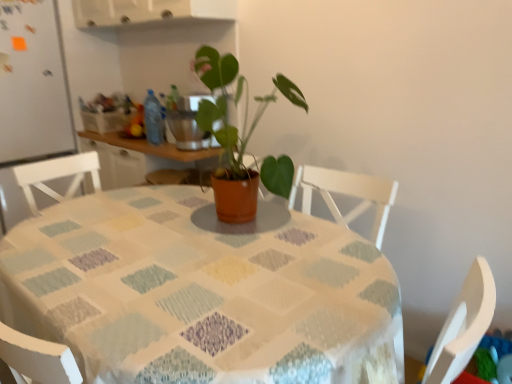
Question: Considering the relative sizes of matte terracotta pot at center and textured fabric tablecloth at center in the image provided, is matte terracotta pot at center wider than textured fabric tablecloth at center?

Choices:
 (A) yes
 (B) no

Answer: (B)

Question: Could you tell me if matte terracotta pot at center is facing textured fabric tablecloth at center?

Choices:
 (A) no
 (B) yes

Answer: (A)

Question: Is matte terracotta pot at center further to the viewer compared to textured fabric tablecloth at center?

Choices:
 (A) no
 (B) yes

Answer: (B)

Question: Is matte terracotta pot at center oriented away from textured fabric tablecloth at center?

Choices:
 (A) yes
 (B) no

Answer: (B)

Question: Is the position of matte terracotta pot at center less distant than that of textured fabric tablecloth at center?

Choices:
 (A) no
 (B) yes

Answer: (A)

Question: Is matte terracotta pot at center inside or outside of white matte refrigerator at left?

Choices:
 (A) inside
 (B) outside

Answer: (B)

Question: Is point (256, 188) positioned closer to the camera than point (15, 132)?

Choices:
 (A) closer
 (B) farther

Answer: (A)

Question: Is matte terracotta pot at center bigger or smaller than white matte refrigerator at left?

Choices:
 (A) small
 (B) big

Answer: (A)

Question: From the image's perspective, relative to white matte refrigerator at left, is matte terracotta pot at center above or below?

Choices:
 (A) above
 (B) below

Answer: (B)

Question: Is blue plastic bottle at center wider or thinner than matte terracotta pot at center?

Choices:
 (A) thin
 (B) wide

Answer: (A)

Question: In terms of size, does blue plastic bottle at center appear bigger or smaller than matte terracotta pot at center?

Choices:
 (A) small
 (B) big

Answer: (A)

Question: Is blue plastic bottle at center to the left or to the right of matte terracotta pot at center in the image?

Choices:
 (A) right
 (B) left

Answer: (B)

Question: Do you think blue plastic bottle at center is within matte terracotta pot at center, or outside of it?

Choices:
 (A) inside
 (B) outside

Answer: (B)

Question: Considering the positions of point coord(54,36) and point coord(236,94), is point coord(54,36) closer or farther from the camera than point coord(236,94)?

Choices:
 (A) closer
 (B) farther

Answer: (B)

Question: Considering the positions of white matte refrigerator at left and matte terracotta pot at center in the image, is white matte refrigerator at left taller or shorter than matte terracotta pot at center?

Choices:
 (A) tall
 (B) short

Answer: (A)